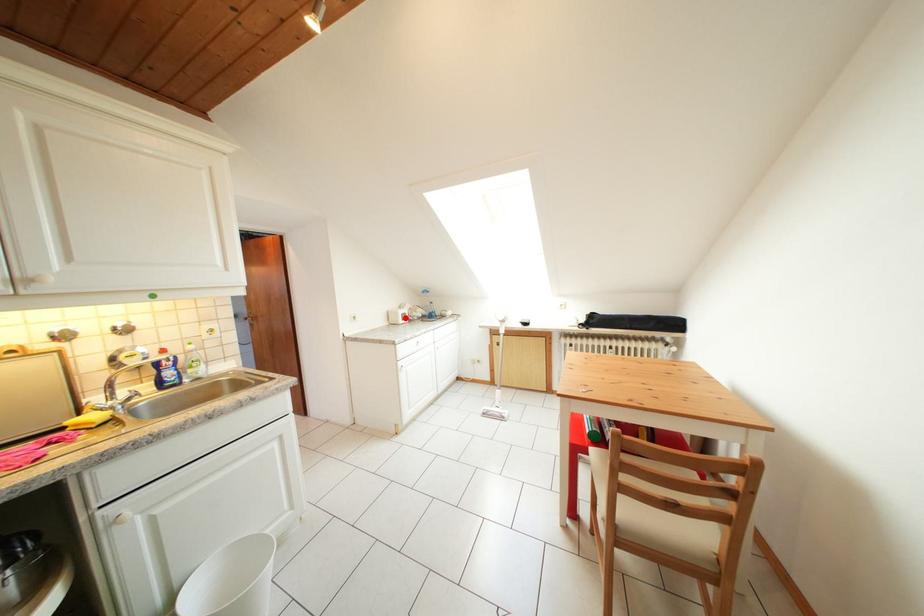
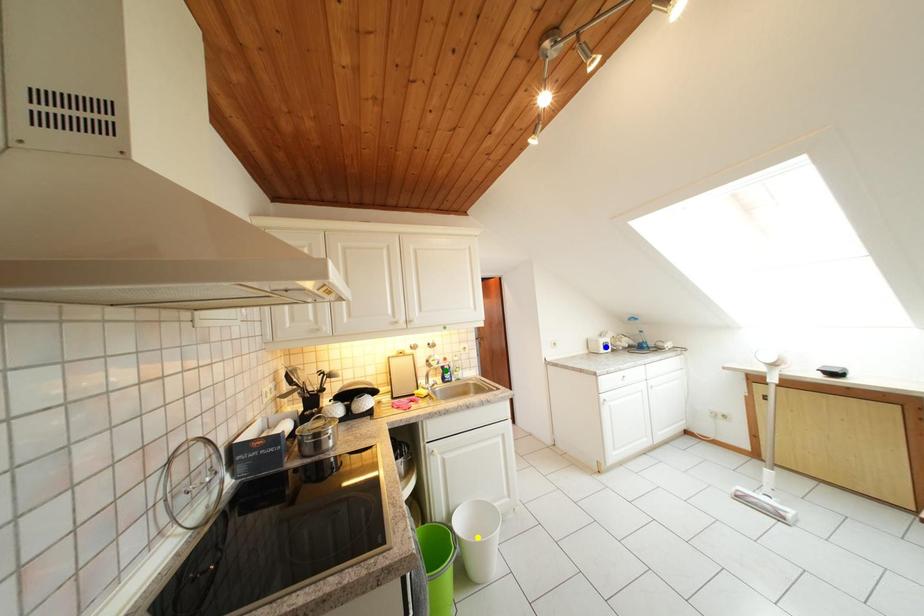
Question: I am providing you with two images of the same scene from different viewpoints. A red point is marked on the first image. You are given multiple points on the second image. Can you choose the point in image 2 that corresponds to the point in image 1?

Choices:
 (A) green point
 (B) blue point
 (C) yellow point

Answer: (B)